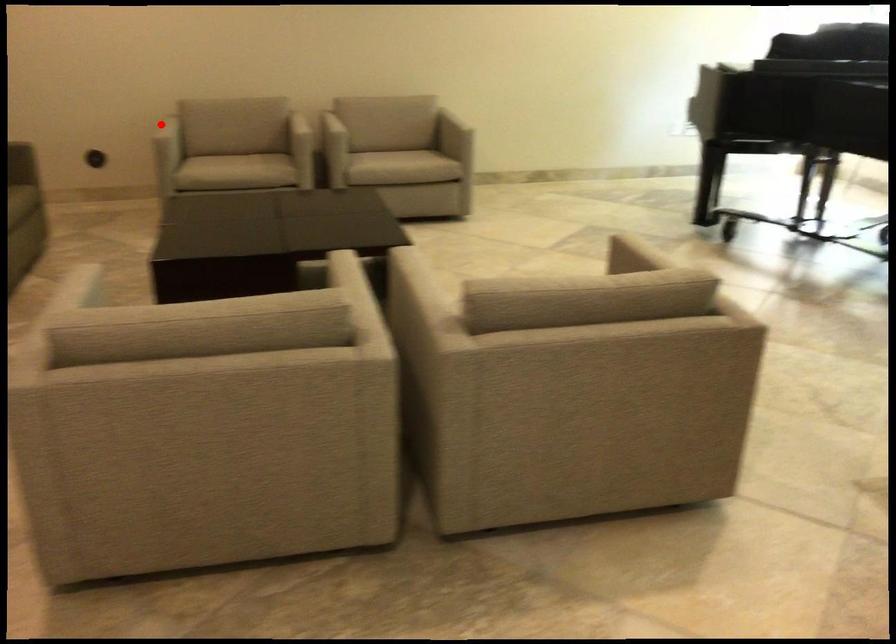
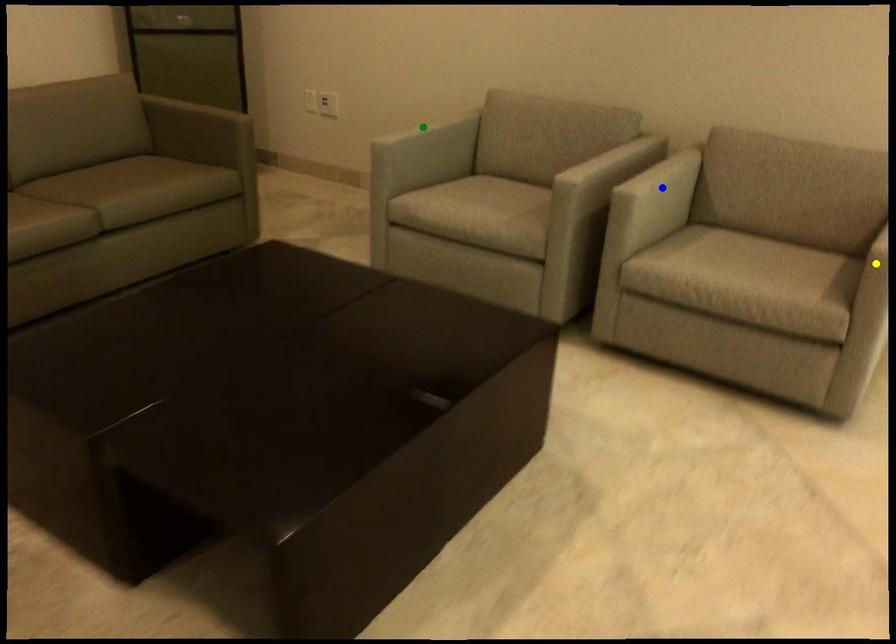
Question: I am providing you with two images of the same scene from different viewpoints. A red point is marked on the first image. You are given multiple points on the second image. Which mark in image 2 goes with the point in image 1?

Choices:
 (A) green point
 (B) blue point
 (C) yellow point

Answer: (A)